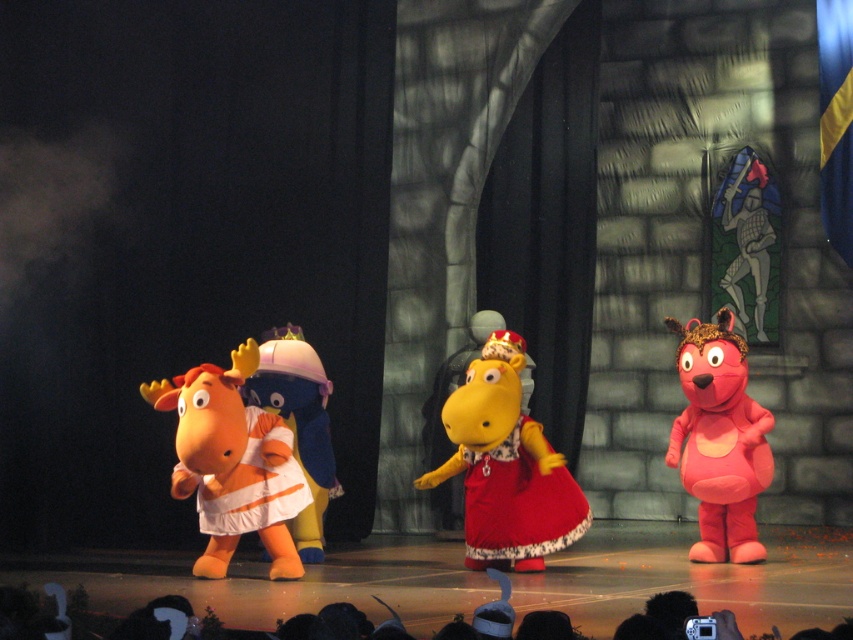
You are an audience member sitting in the front row. You want to see both the orange plush moose at left and the matte red dress at center clearly. Which character should you look at first to ensure you can see both without moving your head?

You should look at the orange plush moose at left first since it is in front of the matte red dress at center, allowing you to see both without moving your head.

You are an audience member sitting in the front row of the stage. You notice two objects on stage, the white fabric duckling at center and the orange fabric dress at center. Which object is taller?

The white fabric duckling at center is taller than the orange fabric dress at center according to the description.

You are a stagehand preparing to adjust the lighting for the performance. You need to ensure that the spotlight reaches both the matte red dress at center and the orange fabric dress at center. Given their positions, which dress should you focus the spotlight on first to ensure proper illumination?

The matte red dress at center is located below the orange fabric dress at center. Since it is lower, you should focus the spotlight on the orange fabric dress at center first to avoid casting a shadow over the matte red dress at center.